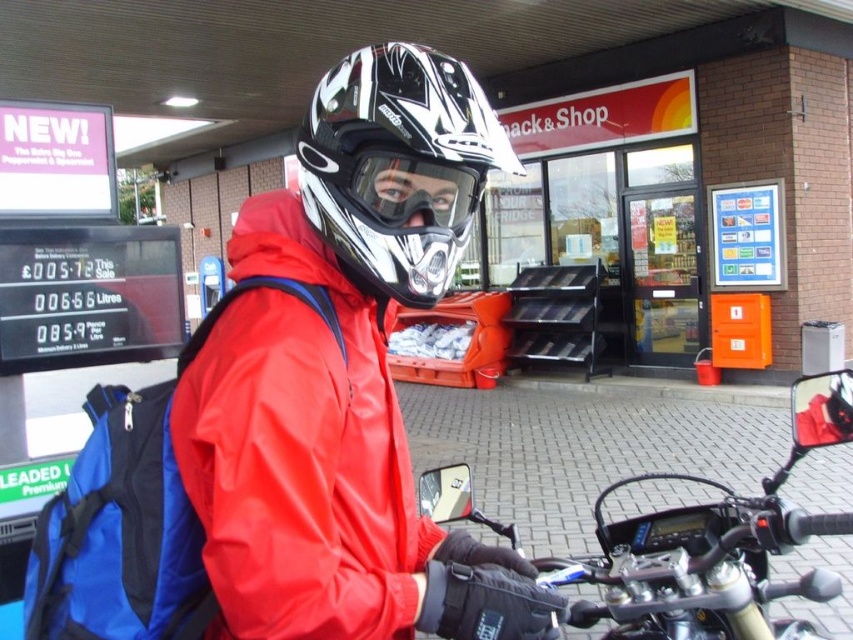
You are a delivery person who needs to locate your matte black helmet at center. The GPS coordinates of the entrance to the Snack and Shop store are at point 0.5, 0.5. Where should you look relative to the entrance?

The matte black helmet at center is located slightly to the right and below the entrance of the Snack and Shop store since its coordinates are at point [345,376], which is east and south of the entrance at [426,320].

You are a customer at the Snack and Shop store and you want to buy the item that is smaller between the glossy white helmet at center and the matte black goggles at center. Which one should you choose?

The matte black goggles at center are smaller than the glossy white helmet at center, so you should choose the matte black goggles at center.